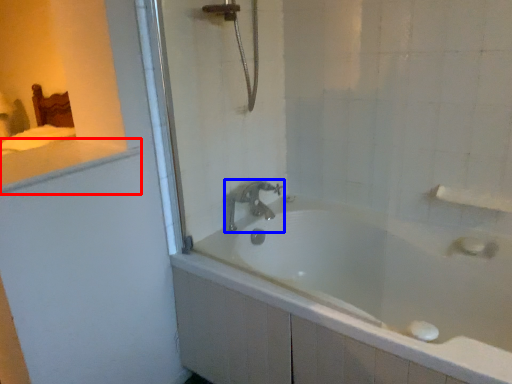
Question: Which point is further to the camera, counter top (highlighted by a red box) or tap (highlighted by a blue box)?

Choices:
 (A) counter top
 (B) tap

Answer: (B)